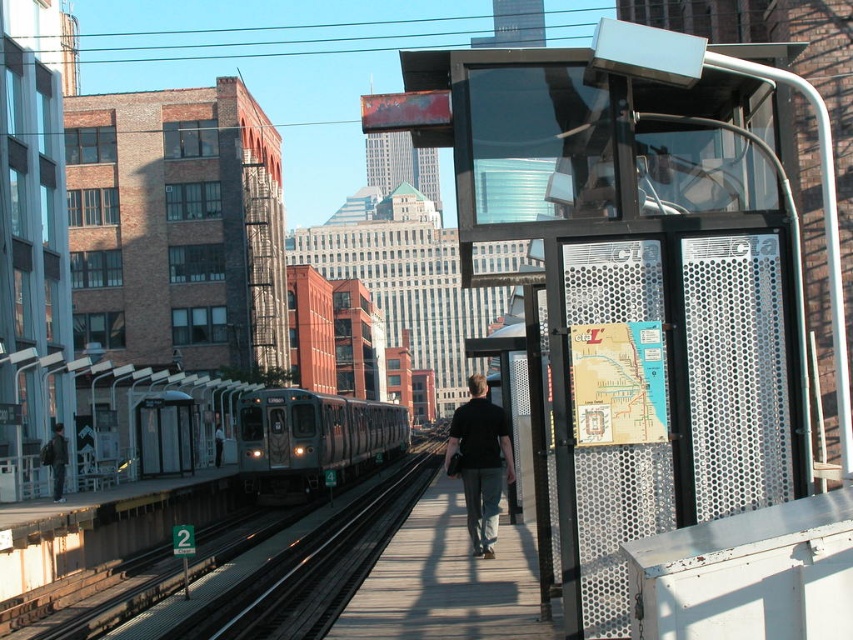
Question: Which object is farther from the camera taking this photo?

Choices:
 (A) black cotton shirt at center
 (B) dark gray jacket at center

Answer: (B)

Question: Is the position of black cotton shirt at center more distant than that of dark gray pants at center?

Choices:
 (A) no
 (B) yes

Answer: (A)

Question: Which point is closer to the camera?

Choices:
 (A) (218, 433)
 (B) (61, 496)
 (C) (303, 474)

Answer: (B)

Question: Is black cotton shirt at center smaller than dark gray jacket at center?

Choices:
 (A) no
 (B) yes

Answer: (B)

Question: Is the position of black cotton shirt at center more distant than that of dark gray jacket at center?

Choices:
 (A) yes
 (B) no

Answer: (B)

Question: Among these points, which one is nearest to the camera?

Choices:
 (A) (239, 417)
 (B) (54, 432)
 (C) (460, 424)
 (D) (213, 442)

Answer: (C)